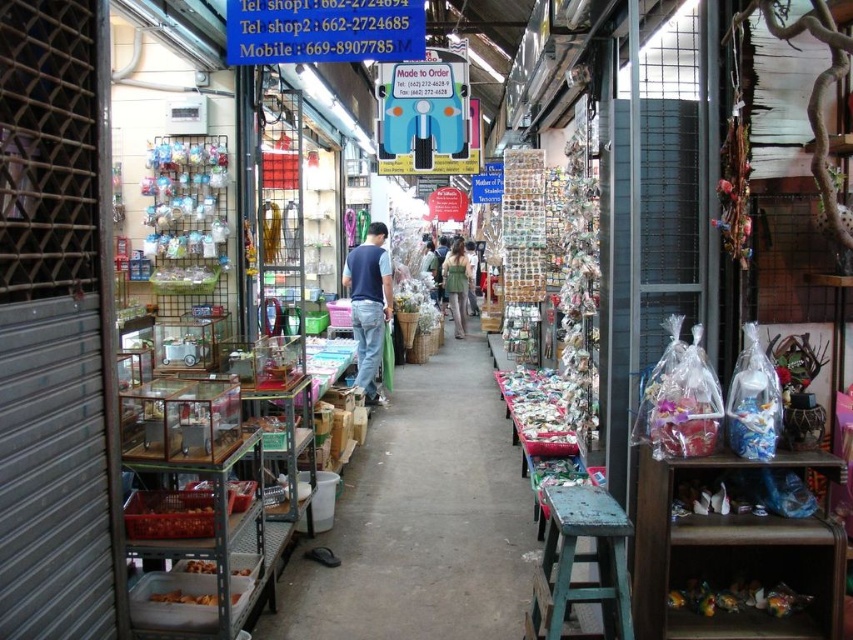
You are a customer in the market and want to buy both the translucent plastic candy at center and the green fabric dress at center. Which item takes up more space on the shelf?

The green fabric dress at center takes up more space on the shelf because it is larger than the translucent plastic candy at center.

You are a customer in this market and want to reach the translucent plastic food at lower right. There is a metallic silver shelves at center blocking your path. Can you walk around the shelves to get to the food?

The metallic silver shelves at center is shorter than the translucent plastic food at lower right, so you can walk around the shelves since they are not as tall as the food item.